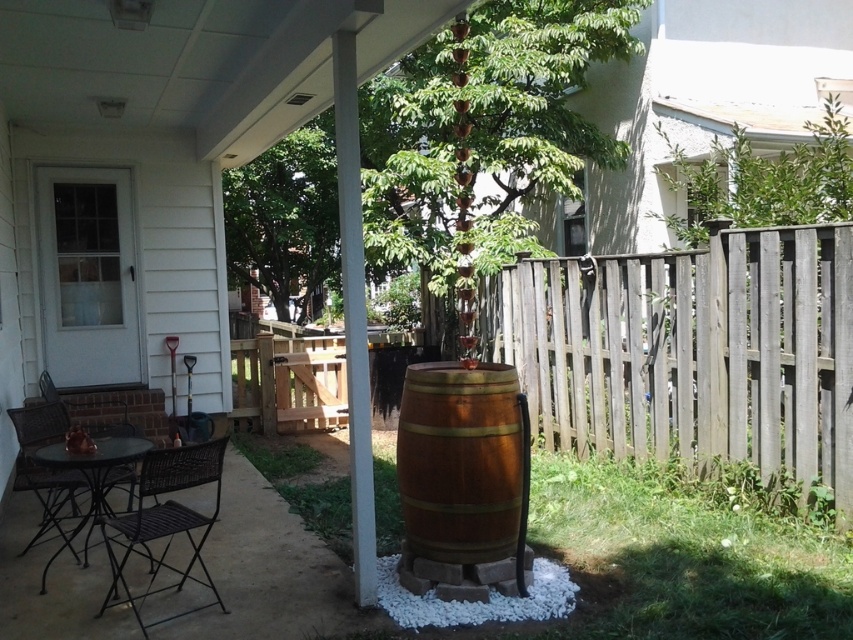
Does point (183, 509) come behind point (112, 440)?

No, it is in front of (112, 440).

Does black wicker chair at lower left have a lesser height compared to matte black table at lower left?

In fact, black wicker chair at lower left may be taller than matte black table at lower left.

Between point (125, 524) and point (73, 540), which one is positioned in front?

Point (125, 524) is in front.

In order to click on black wicker chair at lower left in this screenshot , I will do `click(165, 518)`.

Which is in front, point (15, 460) or point (100, 506)?

Point (100, 506) is more forward.

Does point (22, 468) come farther from viewer compared to point (102, 515)?

Yes, point (22, 468) is farther from viewer.

The image size is (853, 640). In order to click on metallic brown chair at lower left in this screenshot , I will do `click(42, 467)`.

Who is lower down, weathered wood fence at right or metallic brown chair at lower left?

Positioned lower is metallic brown chair at lower left.

Does point (527, 305) come closer to viewer compared to point (18, 490)?

No, it is behind (18, 490).

Does point (701, 336) come closer to viewer compared to point (45, 404)?

No.

Locate an element on the screen. weathered wood fence at right is located at coordinates (694, 352).